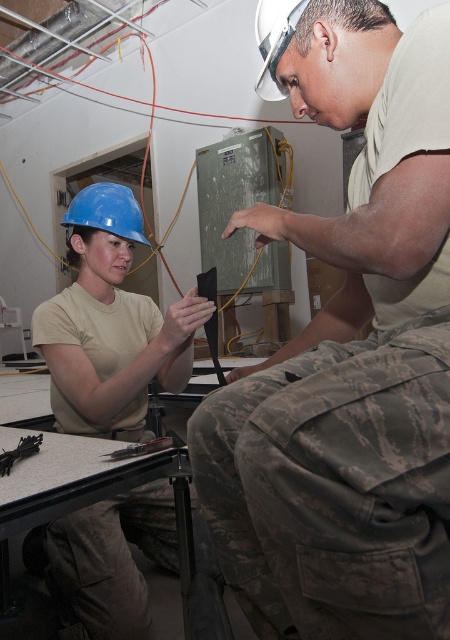
Between matte blue hard hat at left and metallic silver tool at lower left, which one is positioned higher?

Positioned higher is matte blue hard hat at left.

Can you confirm if matte blue hard hat at left is positioned to the right of metallic silver tool at lower left?

Indeed, matte blue hard hat at left is positioned on the right side of metallic silver tool at lower left.

Measure the distance between matte blue hard hat at left and camera.

matte blue hard hat at left and camera are 1.24 meters apart from each other.

In order to click on matte blue hard hat at left in this screenshot , I will do `click(111, 324)`.

Is camouflage fabric pants at lower center positioned before blue matte helmet at upper left?

Yes.

Who is positioned more to the left, camouflage fabric pants at lower center or blue matte helmet at upper left?

blue matte helmet at upper left

In order to click on camouflage fabric pants at lower center in this screenshot , I will do `click(346, 353)`.

Which is more to the left, camouflage fabric pants at lower center or matte blue hard hat at left?

matte blue hard hat at left is more to the left.

This screenshot has height=640, width=450. What do you see at coordinates (346, 353) in the screenshot? I see `camouflage fabric pants at lower center` at bounding box center [346, 353].

Locate an element on the screen. camouflage fabric pants at lower center is located at coordinates (346, 353).

Where is `camouflage fabric pants at lower center`? camouflage fabric pants at lower center is located at coordinates coord(346,353).